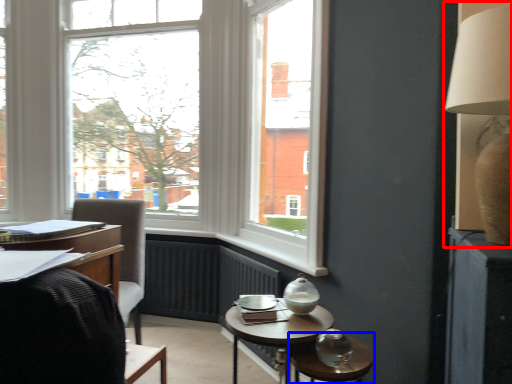
Question: Which of the following is the closest to the observer, table lamp (highlighted by a red box) or glass table (highlighted by a blue box)?

Choices:
 (A) table lamp
 (B) glass table

Answer: (A)